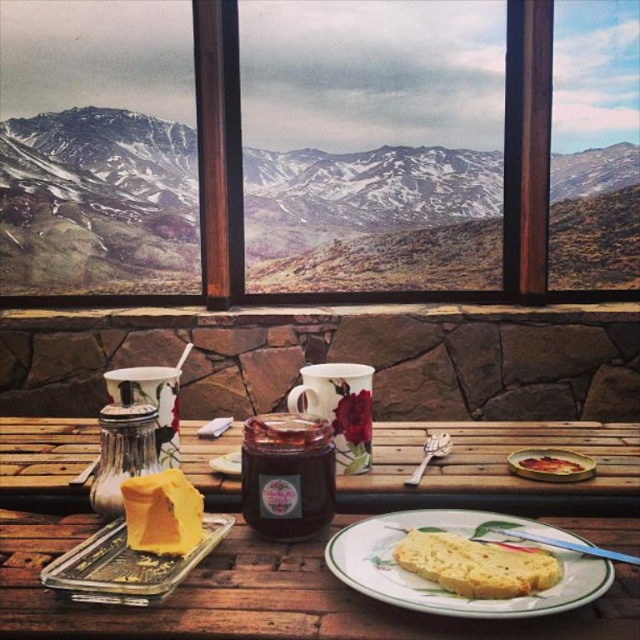
You are a guest in this room and want to take a bite of the golden brown crusty bread at center. However, you notice the transparent glass window at center is blocking your path. Can you reach the bread without moving the window?

The golden brown crusty bread at center is behind the transparent glass window at center, so you can reach it without moving the window since it is not physically blocking your access. The window is part of the background scenery and likely part of the wall, so you can approach the table to get the bread.

You are a chef preparing to place a 10 cm tall bread sculpture on the wooden picnic table at center. Considering the height of the golden brown crusty bread at center, will the sculpture fit without touching the ceiling?

The wooden picnic table at center is taller than the golden brown crusty bread at center. Since the sculpture is 10 cm tall, it should fit on the table without touching the ceiling as long as the table height accommodates it.

You are a photographer setting up a shot of the wooden picnic table at center and the golden brown crusty bread at center. Based on their positions, which object should you focus on first to ensure both are in frame?

The wooden picnic table at center is located above the golden brown crusty bread at center, so you should focus on the wooden picnic table at center first to ensure both are in frame.